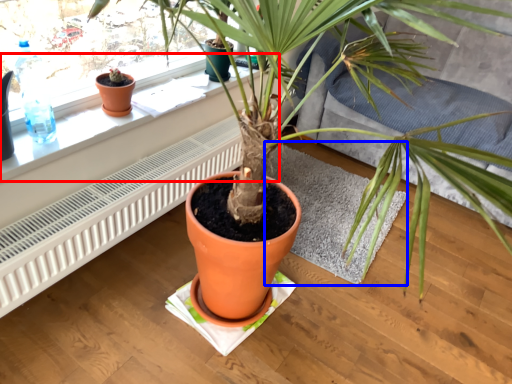
Question: Which of the following is the closest to the observer, window sill (highlighted by a red box) or wide (highlighted by a blue box)?

Choices:
 (A) window sill
 (B) wide

Answer: (A)